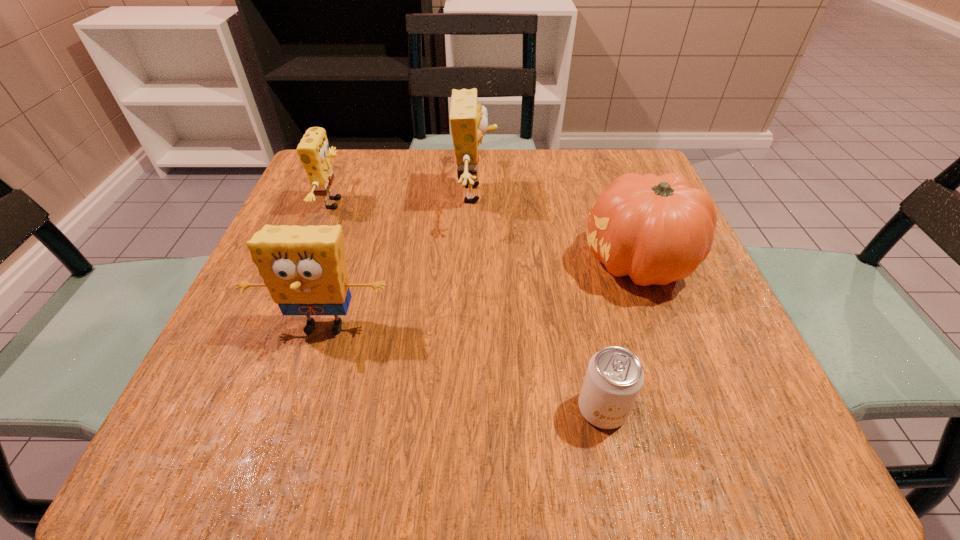
Identify the location of empty location between the shortest sponge and the third object from left to right. The width and height of the screenshot is (960, 540). (405, 199).

Where is `empty space that is in between the rightmost sponge and the pumpkin`? empty space that is in between the rightmost sponge and the pumpkin is located at coordinates (557, 228).

Image resolution: width=960 pixels, height=540 pixels. I want to click on empty space between the pumpkin and the soda can, so click(620, 335).

The width and height of the screenshot is (960, 540). Identify the location of vacant region between the nearest sponge and the shortest object. (464, 368).

Where is `free space between the nearest sponge and the pumpkin`? The height and width of the screenshot is (540, 960). free space between the nearest sponge and the pumpkin is located at coordinates (482, 294).

Where is `unoccupied area between the nearest object and the nearest sponge`? unoccupied area between the nearest object and the nearest sponge is located at coordinates (464, 368).

Where is `vacant area that lies between the shortest sponge and the third object from right to left`? The height and width of the screenshot is (540, 960). vacant area that lies between the shortest sponge and the third object from right to left is located at coordinates (405, 199).

Identify the location of free spot between the pumpkin and the shortest object. (620, 335).

Where is `free area in between the pumpkin and the rightmost sponge`? free area in between the pumpkin and the rightmost sponge is located at coordinates (557, 228).

Locate an element on the screen. The height and width of the screenshot is (540, 960). object that is the third closest to the pumpkin is located at coordinates (304, 268).